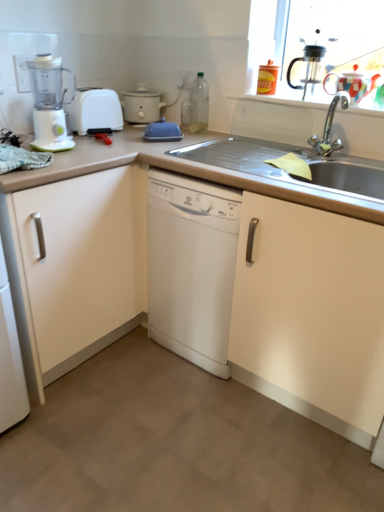
Measure the distance between blue rubber dish drainer at center and camera.

blue rubber dish drainer at center and camera are 5.84 feet apart from each other.

What is the approximate width of multicolored ceramic tea pot at upper right?

It is 5.67 inches.

At what (x,y) coordinates should I click in order to perform the action: click on white matte slow cooker at upper left. Please return your answer as a coordinate pair (x, y). Image resolution: width=384 pixels, height=512 pixels. Looking at the image, I should click on (141, 105).

What are the coordinates of `black plastic coffee machine at upper right` in the screenshot? It's located at (308, 67).

Locate an element on the screen. Image resolution: width=384 pixels, height=512 pixels. blue rubber dish drainer at center is located at coordinates (162, 131).

Considering the positions of objects white plastic toaster at left and black plastic coffee machine at upper right in the image provided, who is behind, white plastic toaster at left or black plastic coffee machine at upper right?

white plastic toaster at left is further from the camera.

Which of these two, white plastic toaster at left or black plastic coffee machine at upper right, is bigger?

white plastic toaster at left.

From the image's perspective, is white plastic toaster at left on top of black plastic coffee machine at upper right?

No.

From a real-world perspective, between white plastic toaster at left and black plastic coffee machine at upper right, who is vertically higher?

From a 3D spatial view, black plastic coffee machine at upper right is above.

Measure the distance from clear plastic bottle at center to white plastic blender at left.

A distance of 62.05 centimeters exists between clear plastic bottle at center and white plastic blender at left.

Between point (192, 122) and point (59, 98), which one is positioned behind?

The point (192, 122) is behind.

Is clear plastic bottle at center wider than white plastic blender at left?

Incorrect, the width of clear plastic bottle at center does not surpass that of white plastic blender at left.

At what (x,y) coordinates should I click in order to perform the action: click on kitchen appliance located in front of the clear plastic bottle at center. Please return your answer as a coordinate pair (x, y). The height and width of the screenshot is (512, 384). Looking at the image, I should click on (50, 103).

Is white plastic blender at left in contact with white matte slow cooker at upper left?

No, white plastic blender at left is not in contact with white matte slow cooker at upper left.

Consider the image. From the image's perspective, between white plastic blender at left and white matte slow cooker at upper left, who is located below?

Result: From the image's view, white plastic blender at left is below.

Which object is positioned more to the left, white plastic blender at left or white matte slow cooker at upper left?

From the viewer's perspective, white plastic blender at left appears more on the left side.

Between white plastic blender at left and matte white countertop at center, which one has larger size?

Bigger between the two is matte white countertop at center.

Locate an element on the screen. counter located in front of the white plastic blender at left is located at coordinates (234, 282).

What's the angular difference between white plastic blender at left and matte white countertop at center's facing directions?

They differ by 90 degrees in their facing directions.

Does point (43, 116) lie behind point (340, 257)?

Yes, point (43, 116) is behind point (340, 257).

Would you consider blue rubber dish drainer at center to be distant from white matte slow cooker at upper left?

That's not correct — blue rubber dish drainer at center is a little close to white matte slow cooker at upper left.

Between point (164, 134) and point (148, 106), which one is positioned behind?

The point (148, 106) is farther.

From the image's perspective, which object appears higher, blue rubber dish drainer at center or white matte slow cooker at upper left?

white matte slow cooker at upper left, from the image's perspective.

In the scene shown: Can you confirm if blue rubber dish drainer at center is thinner than white matte slow cooker at upper left?

Correct, the width of blue rubber dish drainer at center is less than that of white matte slow cooker at upper left.

Is multicolored ceramic tea pot at upper right shorter than matte white cabinet at left?

Yes.

Is there a large distance between multicolored ceramic tea pot at upper right and matte white cabinet at left?

Absolutely, multicolored ceramic tea pot at upper right is distant from matte white cabinet at left.

Considering the sizes of objects multicolored ceramic tea pot at upper right and matte white cabinet at left in the image provided, who is bigger, multicolored ceramic tea pot at upper right or matte white cabinet at left?

matte white cabinet at left.

Is blue rubber dish drainer at center oriented towards multicolored ceramic tea pot at upper right?

No, blue rubber dish drainer at center is not aimed at multicolored ceramic tea pot at upper right.

Who is smaller, blue rubber dish drainer at center or multicolored ceramic tea pot at upper right?

blue rubber dish drainer at center is smaller.

Which object is more forward, blue rubber dish drainer at center or multicolored ceramic tea pot at upper right?

multicolored ceramic tea pot at upper right.

Is blue rubber dish drainer at center at the left side of multicolored ceramic tea pot at upper right?

Yes, blue rubber dish drainer at center is to the left of multicolored ceramic tea pot at upper right.

Locate an element on the screen. coffee machine located above the white plastic toaster at left (from a real-world perspective) is located at coordinates (308, 67).

Where is `bottle located on the right of white plastic blender at left`? This screenshot has width=384, height=512. bottle located on the right of white plastic blender at left is located at coordinates (199, 105).

Considering their positions, is clear plastic bottle at center positioned closer to matte white cabinet at left than white plastic blender at left?

white plastic blender at left lies closer to matte white cabinet at left than the other object.

Looking at the image, which one is located closer to black plastic coffee machine at upper right, multicolored ceramic tea pot at upper right or white plastic blender at left?

multicolored ceramic tea pot at upper right is closer to black plastic coffee machine at upper right.

Which object lies further to the anchor point multicolored ceramic tea pot at upper right, matte white countertop at center or white plastic blender at left?

white plastic blender at left.

From the image, which object appears to be farther from black plastic coffee machine at upper right, blue rubber dish drainer at center or matte white cabinet at left?

matte white cabinet at left lies further to black plastic coffee machine at upper right than the other object.

From the image, which object appears to be farther from matte white countertop at center, multicolored ceramic tea pot at upper right or white matte slow cooker at upper left?

Among the two, multicolored ceramic tea pot at upper right is located further to matte white countertop at center.

Which object lies further to the anchor point matte white countertop at center, black plastic coffee machine at upper right or clear plastic bottle at center?

black plastic coffee machine at upper right lies further to matte white countertop at center than the other object.

When comparing their distances from white plastic toaster at left, does white matte slow cooker at upper left or matte white cabinet at left seem further?

matte white cabinet at left is positioned further to the anchor white plastic toaster at left.

Considering their positions, is clear plastic bottle at center positioned closer to matte white countertop at center than white plastic blender at left?

clear plastic bottle at center is positioned closer to the anchor matte white countertop at center.

I want to click on cooker between matte white cabinet at left and multicolored ceramic tea pot at upper right from left to right, so click(x=141, y=105).

Where is `counter situated between matte white cabinet at left and multicolored ceramic tea pot at upper right from left to right`? The height and width of the screenshot is (512, 384). counter situated between matte white cabinet at left and multicolored ceramic tea pot at upper right from left to right is located at coordinates (234, 282).

You are a GUI agent. You are given a task and a screenshot of the screen. Output one action in this format:
    pyautogui.click(x=<x>, y=<y>)
    Task: Click on the tea pot between matte white countertop at center and blue rubber dish drainer at center along the z-axis
    This screenshot has width=384, height=512.
    Given the screenshot: What is the action you would take?
    [350, 83]

Identify the location of kitchen appliance that lies between white matte slow cooker at upper left and matte white cabinet at left from top to bottom. (50, 103).